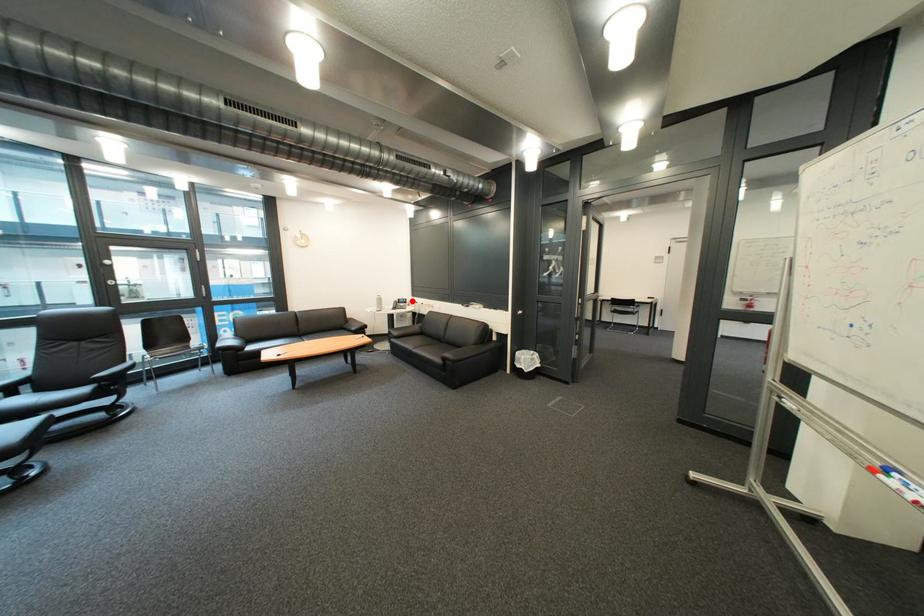
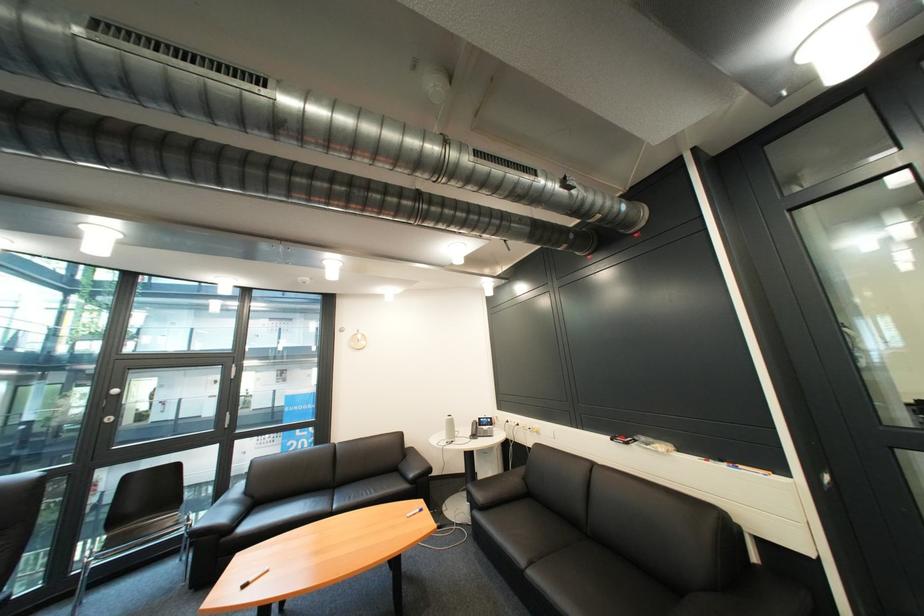
Question: I am providing you with two images of the same scene from different viewpoints. In image1, a red point is highlighted. Considering the same 3D point in image2, which of the following is correct?

Choices:
 (A) It is closer
 (B) It is farther

Answer: (B)